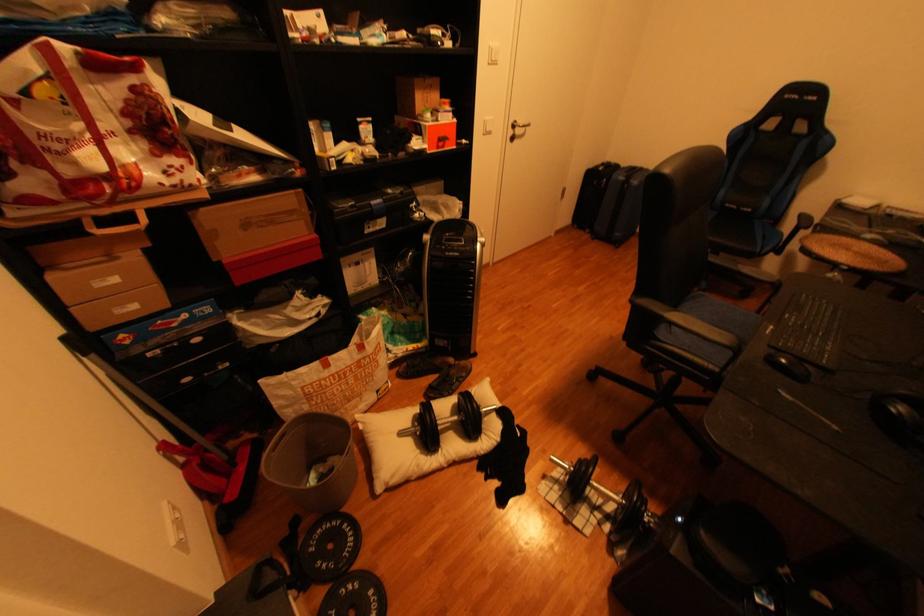
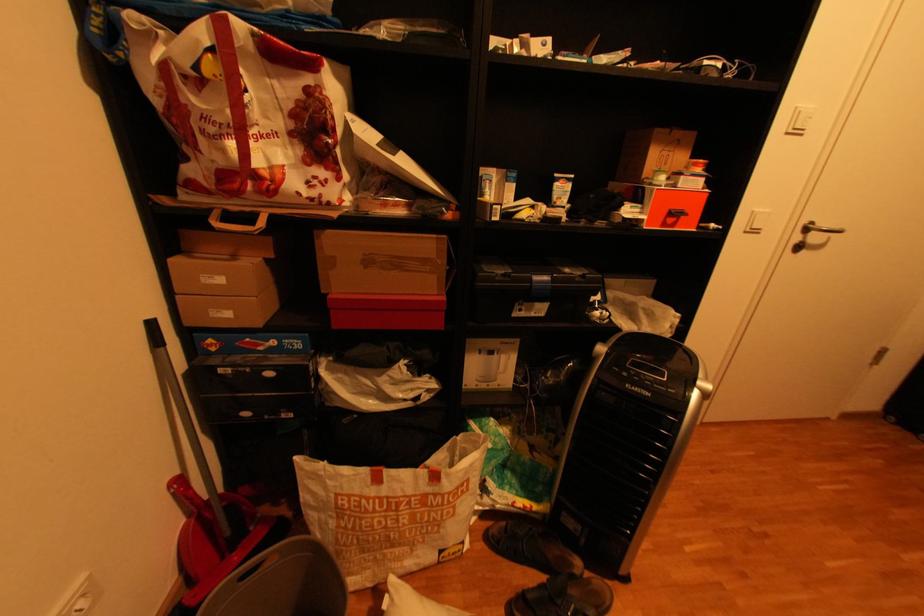
The point at (497, 63) is marked in the first image. Where is the corresponding point in the second image?

(796, 134)